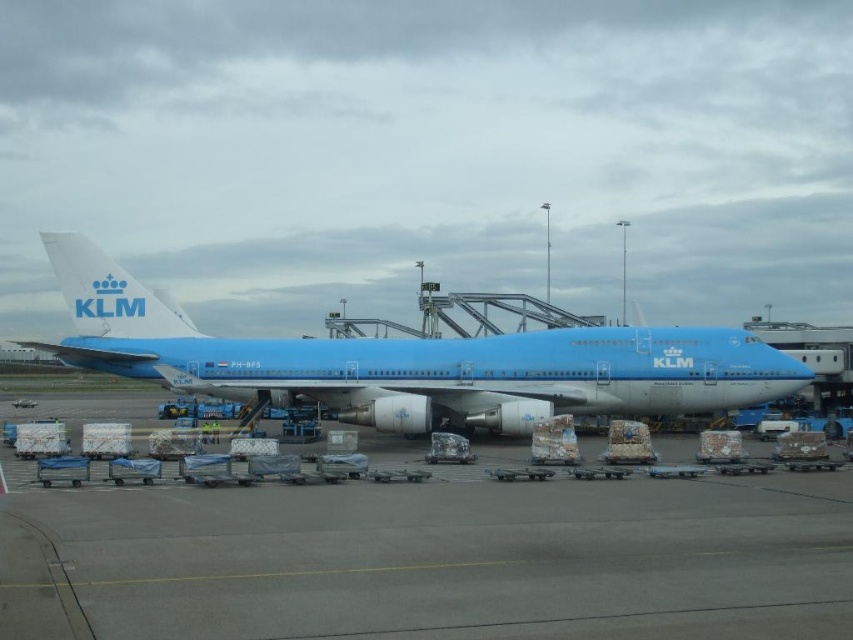
Is point (24, 625) positioned before point (798, 388)?

Yes.

Who is positioned more to the right, blue matte tarmac at center or blue matte airplane at center?

blue matte tarmac at center is more to the right.

Who is more forward, (804, 481) or (670, 410)?

Point (804, 481)

You are a GUI agent. You are given a task and a screenshot of the screen. Output one action in this format:
    pyautogui.click(x=<x>, y=<y>)
    Task: Click on the blue matte tarmac at center
    This screenshot has width=853, height=640.
    Given the screenshot: What is the action you would take?
    pyautogui.click(x=431, y=560)